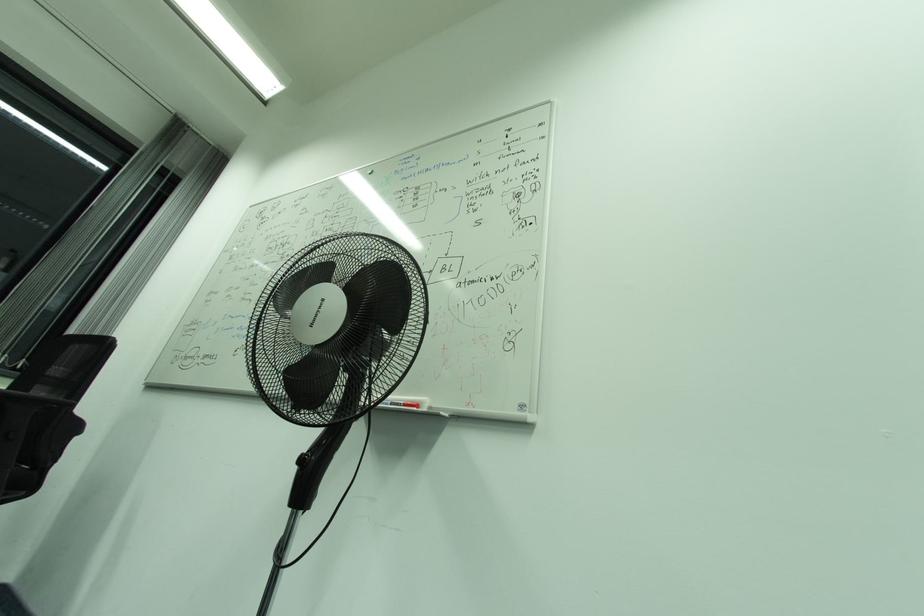
Where would you rest the chair armrest? Please return your answer as a coordinate pair (x, y).

(30, 402)